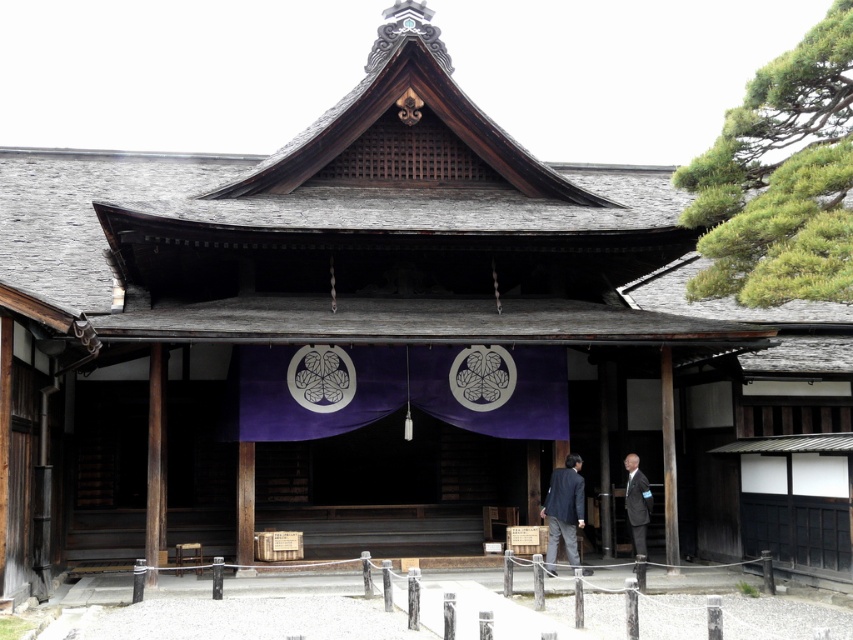
Is point (555, 572) closer to camera compared to point (647, 522)?

Yes.

Who is more distant from viewer, (573, 550) or (643, 496)?

Positioned behind is point (643, 496).

Where is `dark blue suit at center`? dark blue suit at center is located at coordinates (563, 509).

Is brown wooden pillar at center smaller than dark gray suit at center?

No.

Is brown wooden pillar at center further to the viewer compared to dark gray suit at center?

No, it is not.

Which is behind, point (670, 476) or point (630, 506)?

The point (630, 506) is behind.

This screenshot has width=853, height=640. Find the location of `brown wooden pillar at center`. brown wooden pillar at center is located at coordinates (668, 461).

Which is more to the right, dark blue suit at center or brown wooden pillar at center?

Positioned to the right is brown wooden pillar at center.

Does point (573, 456) come closer to viewer compared to point (670, 544)?

No, (573, 456) is further to viewer.

Image resolution: width=853 pixels, height=640 pixels. I want to click on dark blue suit at center, so click(x=563, y=509).